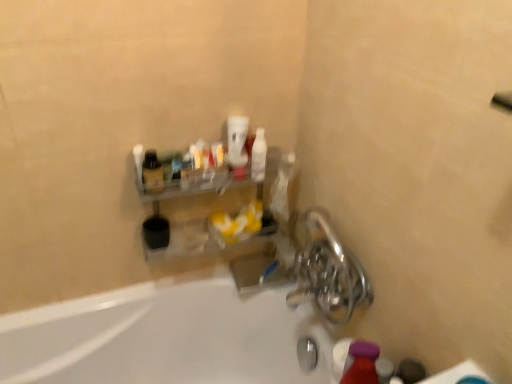
Question: Which is correct: white glossy cup at upper center, which ranks as the 2th mouthwash in right-to-left order, is inside matte purple bottle at lower right, or outside of it?

Choices:
 (A) outside
 (B) inside

Answer: (A)

Question: Looking at their shapes, would you say white glossy cup at upper center, which ranks as the 2th mouthwash in right-to-left order, is wider or thinner than matte purple bottle at lower right?

Choices:
 (A) thin
 (B) wide

Answer: (B)

Question: Which object is positioned closest to the white glossy cup at upper center, which ranks as the 2th mouthwash in right-to-left order?

Choices:
 (A) white glossy bathtub at lower left
 (B) matte black bottle at upper left
 (C) shiny metallic faucet at lower right
 (D) white glossy bottle at upper center, placed as the second mouthwash when sorted from left to right
 (E) matte purple bottle at lower right

Answer: (D)

Question: Based on their relative distances, which object is nearer to the white glossy cup at upper center, positioned as the 1th mouthwash in left-to-right order?

Choices:
 (A) matte black bottle at upper left
 (B) shiny metallic faucet at lower right
 (C) white glossy bathtub at lower left
 (D) white glossy bottle at upper center, the 1th mouthwash positioned from the right
 (E) matte purple bottle at lower right

Answer: (D)